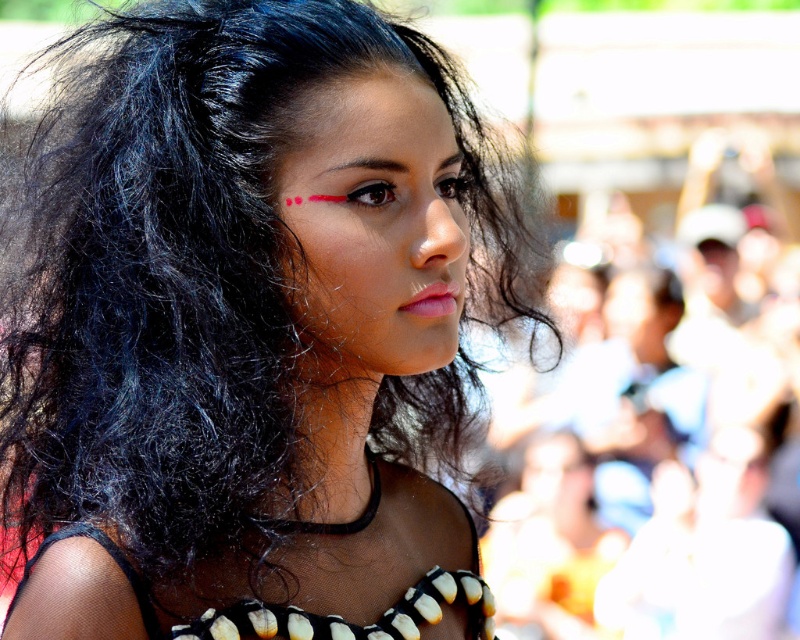
Question: Is matte black face at center to the left of dark brown hair at upper center from the viewer's perspective?

Choices:
 (A) no
 (B) yes

Answer: (A)

Question: Which point is closer to the camera?

Choices:
 (A) (322, 214)
 (B) (428, 134)
 (C) (544, 547)
 (D) (401, 168)

Answer: (A)

Question: Can you confirm if smooth skin at center is wider than dark brown hair at upper center?

Choices:
 (A) no
 (B) yes

Answer: (B)

Question: Which of the following is the farthest from the observer?

Choices:
 (A) matte black face at center
 (B) blurred white crowd at right
 (C) dark brown hair at upper center
 (D) black mesh dress at center

Answer: (B)

Question: Is blurred white crowd at right positioned behind black mesh dress at center?

Choices:
 (A) yes
 (B) no

Answer: (A)

Question: Which point is farther to the camera?

Choices:
 (A) blurred white crowd at right
 (B) black mesh dress at center

Answer: (A)